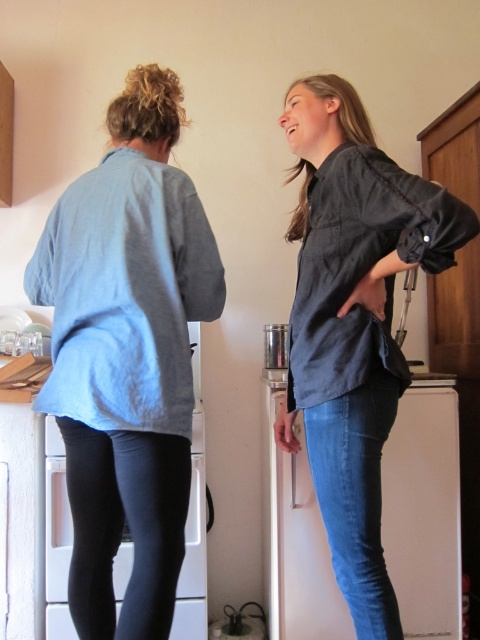
Is blue denim jeans at lower center smaller than black matte leggings at lower left?

Incorrect, blue denim jeans at lower center is not smaller in size than black matte leggings at lower left.

Between point (419, 497) and point (196, 444), which one is positioned behind?

The point (196, 444) is behind.

Identify the location of blue denim jeans at lower center. (423, 509).

Looking at this image, is light blue cotton shirt at back bigger than blue denim jeans at lower center?

No.

Which is above, light blue cotton shirt at back or blue denim jeans at lower center?

light blue cotton shirt at back

Is point (91, 618) farther from camera compared to point (425, 419)?

No, it is in front of (425, 419).

At what (x,y) coordinates should I click in order to perform the action: click on light blue cotton shirt at back. Please return your answer as a coordinate pair (x, y). Image resolution: width=480 pixels, height=640 pixels. Looking at the image, I should click on (127, 355).

Is point (370, 628) farther from viewer compared to point (68, 636)?

No, it is not.

Does dark gray linen shirt at center have a larger size compared to black matte leggings at lower left?

Yes, dark gray linen shirt at center is bigger than black matte leggings at lower left.

I want to click on dark gray linen shirt at center, so click(354, 321).

Image resolution: width=480 pixels, height=640 pixels. Identify the location of dark gray linen shirt at center. (354, 321).